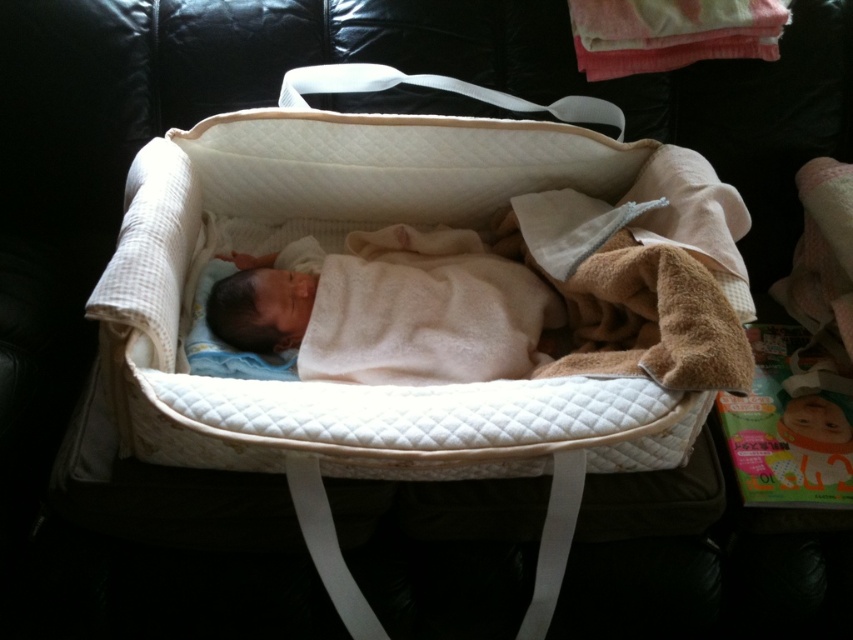
Question: From the image, what is the correct spatial relationship of white quilted mattress at center in relation to white soft blanket at center?

Choices:
 (A) above
 (B) below

Answer: (A)

Question: Can you confirm if white quilted mattress at center is smaller than white soft blanket at center?

Choices:
 (A) yes
 (B) no

Answer: (B)

Question: Does white quilted mattress at center appear over white soft blanket at center?

Choices:
 (A) yes
 (B) no

Answer: (A)

Question: Which of the following is the farthest from the observer?

Choices:
 (A) white soft blanket at center
 (B) white quilted mattress at center

Answer: (A)

Question: Which point appears closest to the camera in this image?

Choices:
 (A) (666, 154)
 (B) (438, 337)

Answer: (B)

Question: Which of the following is the closest to the observer?

Choices:
 (A) (368, 448)
 (B) (547, 291)

Answer: (A)